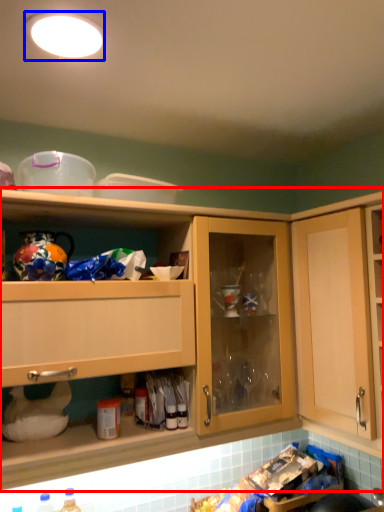
Question: Which of the following is the closest to the observer, cabinetry (highlighted by a red box) or lighting (highlighted by a blue box)?

Choices:
 (A) cabinetry
 (B) lighting

Answer: (B)